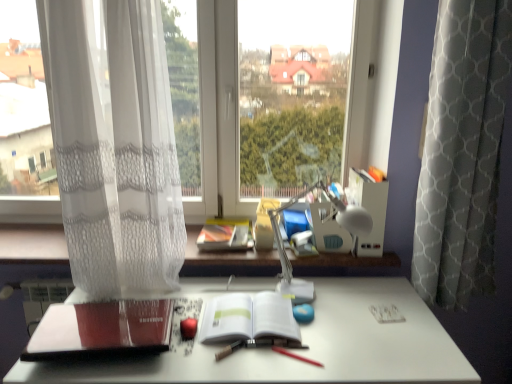
Question: Relative to red matte book at lower left, positioned as the 1th paperback book in left-to-right order, is smooth red crayon at center in front or behind?

Choices:
 (A) behind
 (B) front

Answer: (A)

Question: In terms of height, does smooth red crayon at center look taller or shorter compared to red matte book at lower left, marked as the 2th paperback book in a right-to-left arrangement?

Choices:
 (A) tall
 (B) short

Answer: (B)

Question: Which object is the closest to the white plastic table lamp at center?

Choices:
 (A) white sheer curtain at left, positioned as the first curtain in left-to-right order
 (B) transparent glass window at center
 (C) white paper at center, placed as the 1th paperback book when sorted from right to left
 (D) white matte desk at center
 (E) gray textured curtain at right, marked as the 1th curtain in a right-to-left arrangement

Answer: (C)

Question: Estimate the real-world distances between objects in this image. Which object is closer to the red matte book at lower left, marked as the 2th paperback book in a right-to-left arrangement?

Choices:
 (A) white sheer curtain at left, the second curtain from the right
 (B) white plastic table lamp at center
 (C) gray textured curtain at right, marked as the 1th curtain in a right-to-left arrangement
 (D) white paper at center, placed as the 1th paperback book when sorted from right to left
 (E) transparent glass window at center

Answer: (D)